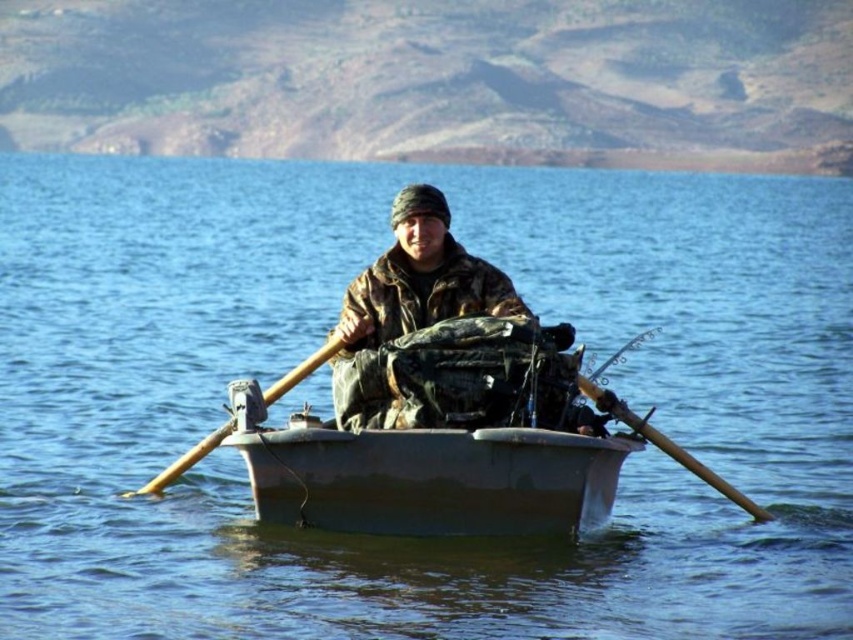
Question: Can you confirm if camouflage fabric jacket at center is positioned below yellow wood paddle at center?

Choices:
 (A) yes
 (B) no

Answer: (B)

Question: Which object appears closest to the camera in this image?

Choices:
 (A) camouflage fabric jacket at center
 (B) yellow wood paddle at center
 (C) gray matte canoe at center

Answer: (C)

Question: Which point is closer to the camera?

Choices:
 (A) (462, 305)
 (B) (540, 486)
 (C) (202, 440)
 (D) (647, 429)

Answer: (B)

Question: Which object is farther from the camera taking this photo?

Choices:
 (A) gray matte canoe at center
 (B) wooden at right
 (C) yellow wood paddle at center

Answer: (C)

Question: Is camouflage fabric jacket at center bigger than yellow wood paddle at center?

Choices:
 (A) yes
 (B) no

Answer: (B)

Question: Can you confirm if gray matte canoe at center is smaller than wooden at right?

Choices:
 (A) no
 (B) yes

Answer: (B)